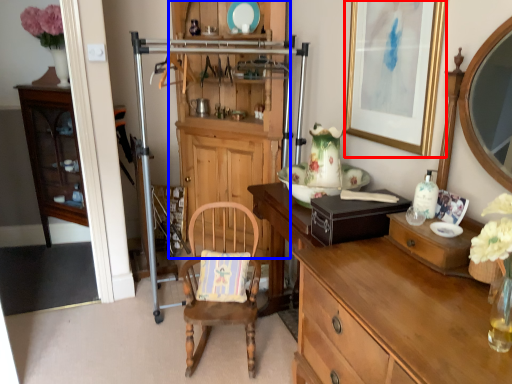
Question: Which of the following is the closest to the observer, picture frame (highlighted by a red box) or cabinetry (highlighted by a blue box)?

Choices:
 (A) picture frame
 (B) cabinetry

Answer: (A)